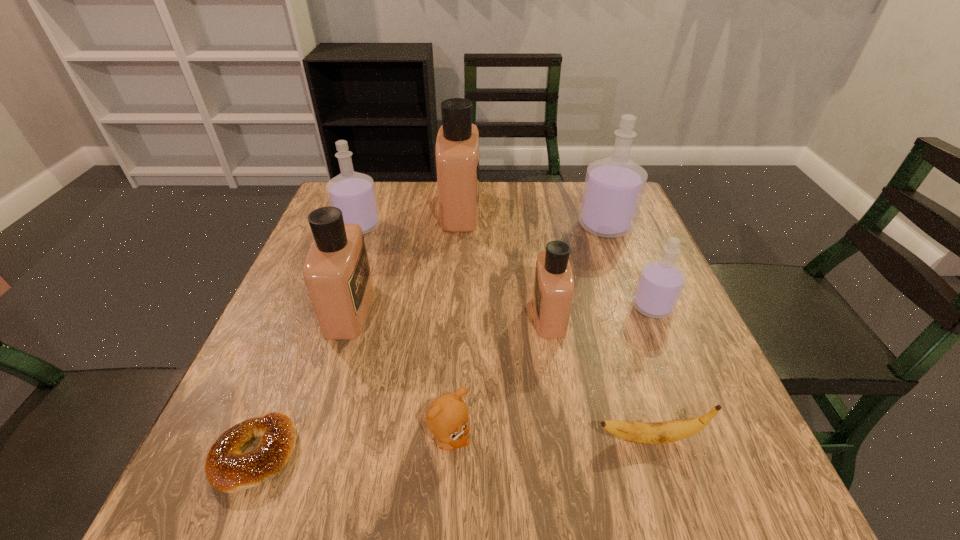
Locate an element on the screen. This screenshot has width=960, height=540. yellow banana is located at coordinates point(660,432).

Where is `the eighth tallest object`? Image resolution: width=960 pixels, height=540 pixels. the eighth tallest object is located at coordinates (660, 432).

Find the location of a particular element. This screenshot has height=540, width=960. bagel is located at coordinates pyautogui.click(x=228, y=469).

This screenshot has width=960, height=540. Identify the location of tan bagel. (228, 469).

The width and height of the screenshot is (960, 540). I want to click on free space located on the front label of the second beige perfume from left to right, so click(x=512, y=210).

Image resolution: width=960 pixels, height=540 pixels. What are the coordinates of `free space located 0.060m on the front of the biggest purple perfume` in the screenshot? It's located at (617, 256).

This screenshot has height=540, width=960. What are the coordinates of `free space located on the front of the leftmost purple perfume` in the screenshot? It's located at (319, 335).

This screenshot has height=540, width=960. What are the coordinates of `vacant position located 0.220m on the front label of the second smallest beige perfume` in the screenshot? It's located at click(472, 309).

Locate an element on the screen. This screenshot has height=540, width=960. vacant space located 0.160m on the front label of the smallest beige perfume is located at coordinates (458, 315).

The height and width of the screenshot is (540, 960). I want to click on vacant space located on the front label of the smallest beige perfume, so click(x=411, y=315).